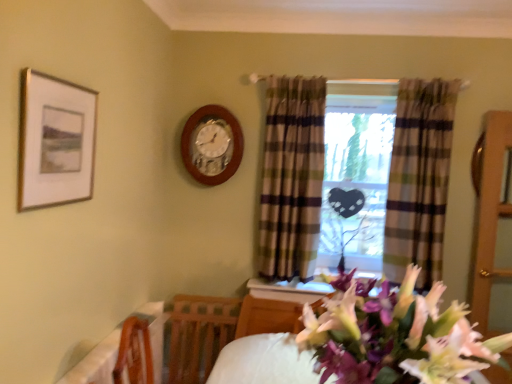
Question: From a real-world perspective, is gold-framed picture at upper left above or below clear glass door at right?

Choices:
 (A) above
 (B) below

Answer: (A)

Question: Which is correct: gold-framed picture at upper left is inside clear glass door at right, or outside of it?

Choices:
 (A) outside
 (B) inside

Answer: (A)

Question: Which object is positioned farthest from the plaid fabric window at center?

Choices:
 (A) plaid fabric curtain at center, arranged as the 1th curtain when viewed from the left
 (B) plaid fabric curtain at center, the second curtain viewed from the left
 (C) wooden table at lower left
 (D) gold-framed picture at upper left
 (E) wooden wall clock at center

Answer: (D)

Question: Considering the real-world distances, which object is closest to the pink silky flowers at center?

Choices:
 (A) gold-framed picture at upper left
 (B) plaid fabric curtain at center, which is the first curtain in right-to-left order
 (C) plaid fabric window at center
 (D) wooden wall clock at center
 (E) plaid fabric curtain at center, arranged as the 1th curtain when viewed from the left

Answer: (A)